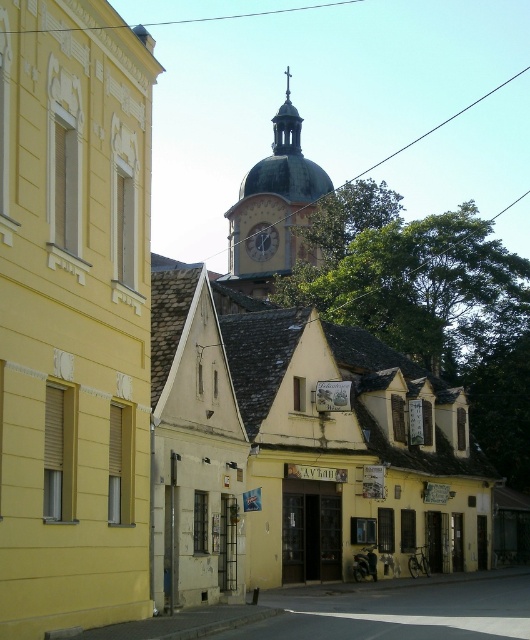
Question: Which of these objects is positioned closest to the golden dome clock tower at upper center?

Choices:
 (A) gold metallic clock at center
 (B) yellow stucco church at center

Answer: (A)

Question: Does yellow stucco church at center have a smaller size compared to golden dome clock tower at upper center?

Choices:
 (A) no
 (B) yes

Answer: (B)

Question: Is yellow stucco church at center to the right of golden dome clock tower at upper center from the viewer's perspective?

Choices:
 (A) no
 (B) yes

Answer: (A)

Question: Which point is closer to the camera taking this photo?

Choices:
 (A) (75, 244)
 (B) (248, 244)
 (C) (286, 92)

Answer: (A)

Question: Is golden dome clock tower at upper center bigger than gold metallic clock at center?

Choices:
 (A) no
 (B) yes

Answer: (B)

Question: Which point is farther to the camera?

Choices:
 (A) (38, 490)
 (B) (252, 232)

Answer: (B)